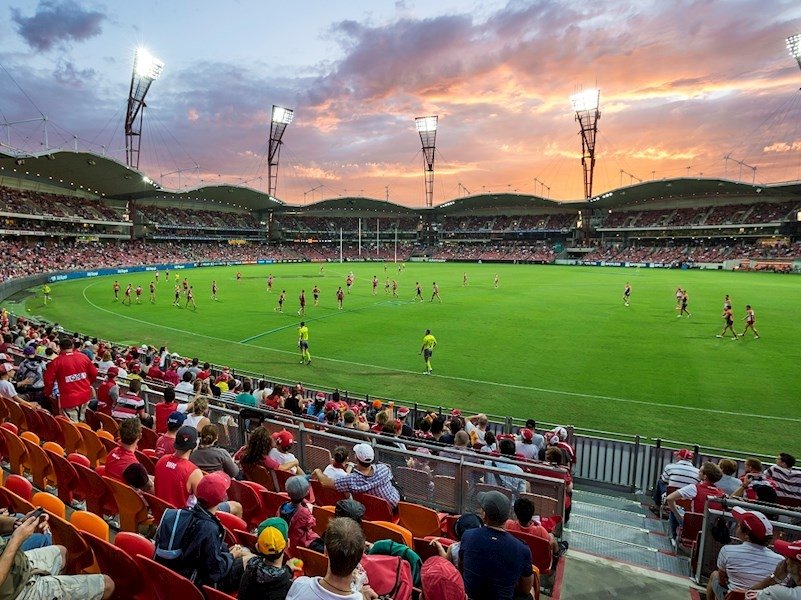
Where is `overhead lights`? The width and height of the screenshot is (801, 600). overhead lights is located at coordinates (143, 68).